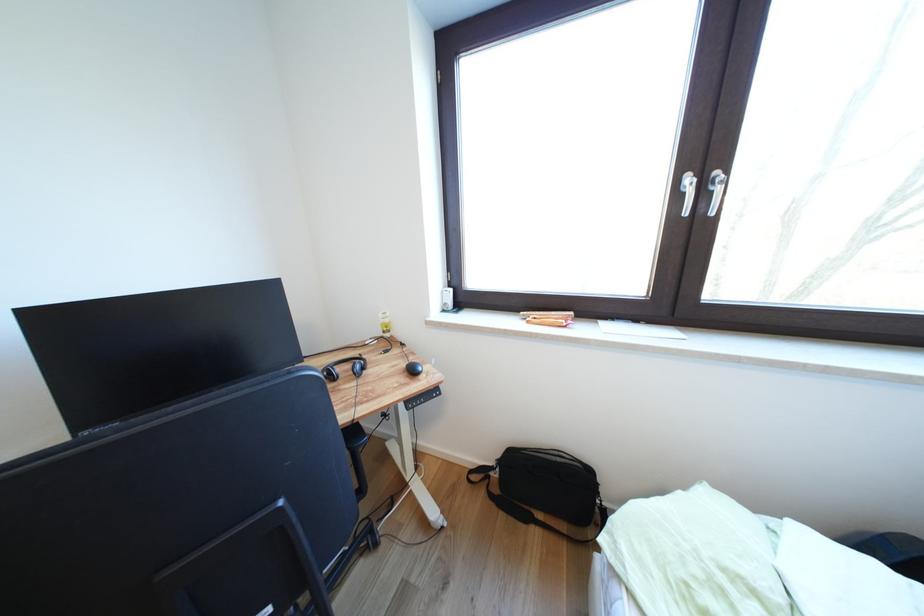
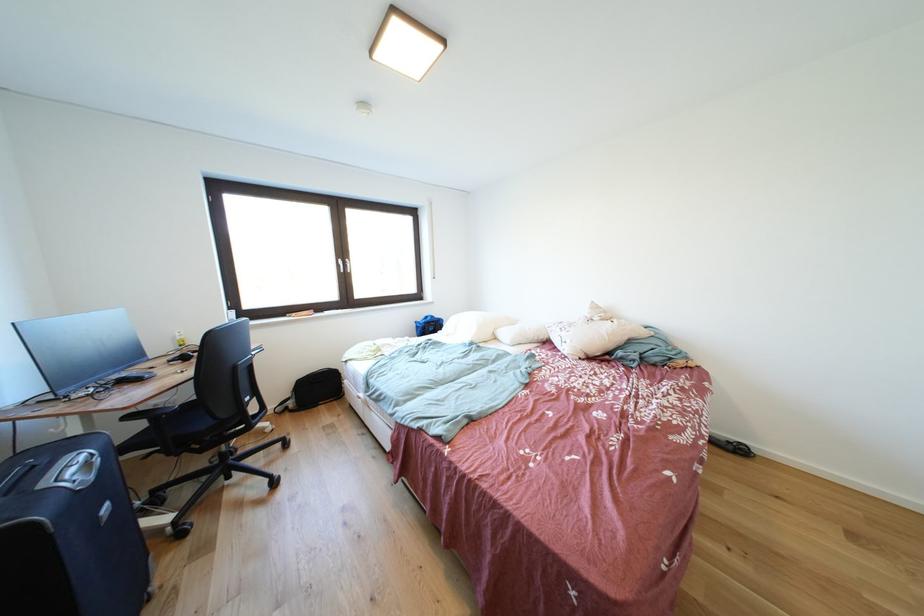
Where in the second image is the point corresponding to the point at 698,184 from the first image?

(348, 265)